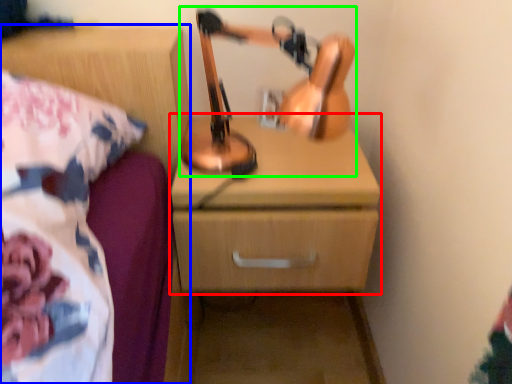
Question: Which object is positioned farthest from chest of drawers (highlighted by a red box)? Select from nightstand (highlighted by a blue box) and table lamp (highlighted by a green box).

Choices:
 (A) nightstand
 (B) table lamp

Answer: (A)